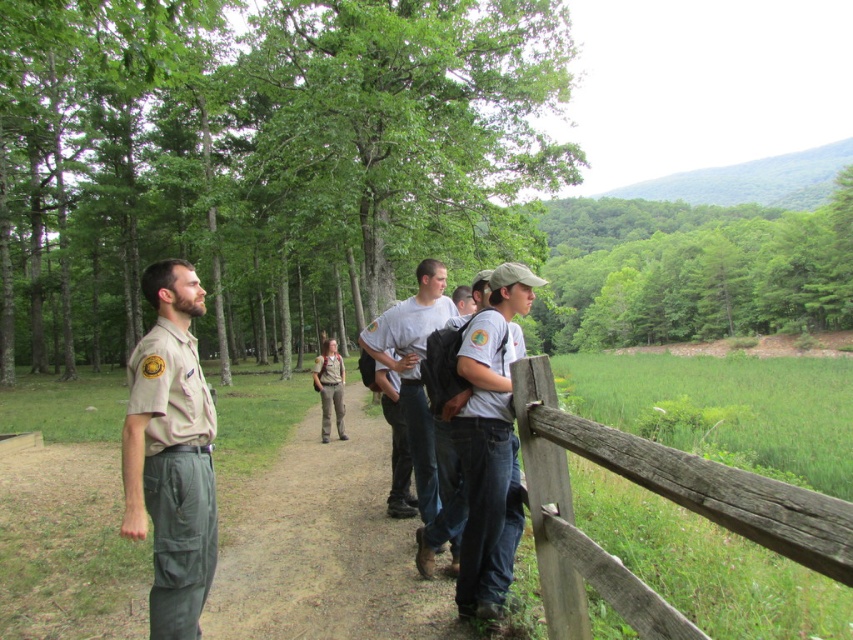
You are standing at the wooden fence in the forest scene. You see two points marked in the image, point A at coordinates point [843,529] and point B at coordinates point [154,508]. Which point is closer to you?

Point point [843,529] is closer to the viewer than point point [154,508].

You are standing at the origin point of the image. A person wearing a tan uniform at center is located at coordinates point 0.709, 0.202. If you want to reach them, which direction should you move relative to your current position?

The tan uniform at center is located at coordinates point (171, 452). To reach them, you should move towards the right and slightly downward from your current position at the origin.